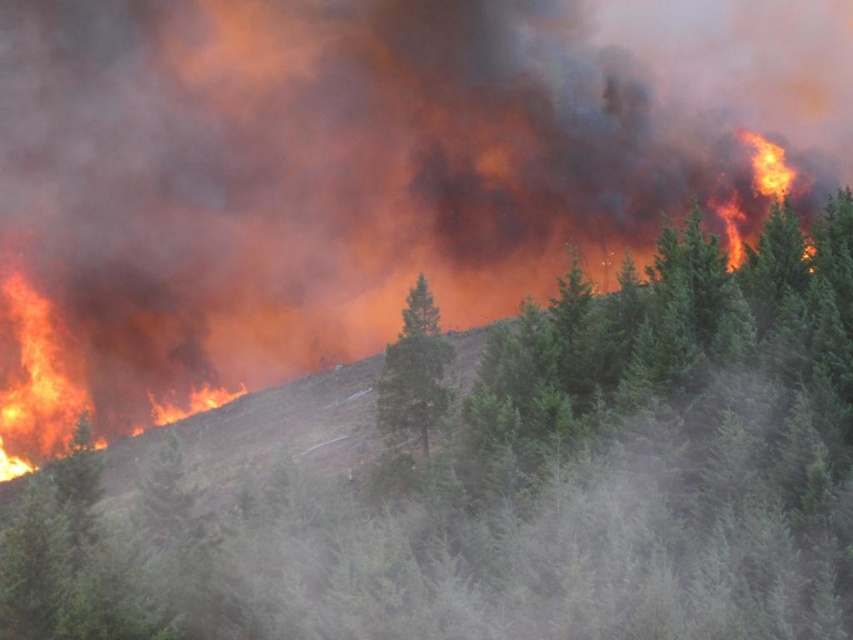
Question: Among these points, which one is nearest to the camera?

Choices:
 (A) (421, 296)
 (B) (770, 531)

Answer: (B)

Question: Can you confirm if green textured tree at center is positioned above green matte tree at center?

Choices:
 (A) no
 (B) yes

Answer: (A)

Question: Is green textured tree at center bigger than green matte tree at center?

Choices:
 (A) yes
 (B) no

Answer: (A)

Question: Is green textured tree at center positioned before green matte tree at center?

Choices:
 (A) no
 (B) yes

Answer: (B)

Question: Which point is closer to the camera taking this photo?

Choices:
 (A) (409, 358)
 (B) (511, 618)

Answer: (B)